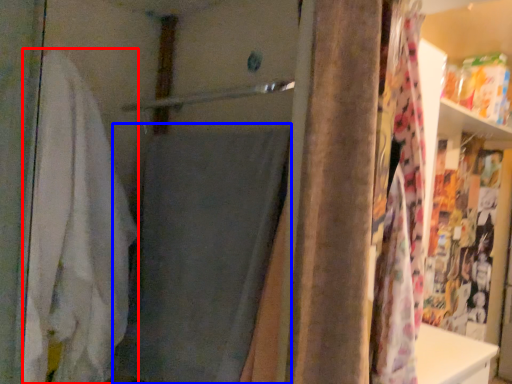
Question: Which object appears closest to the camera in this image, bath towel (highlighted by a red box) or bath towel (highlighted by a blue box)?

Choices:
 (A) bath towel
 (B) bath towel

Answer: (B)